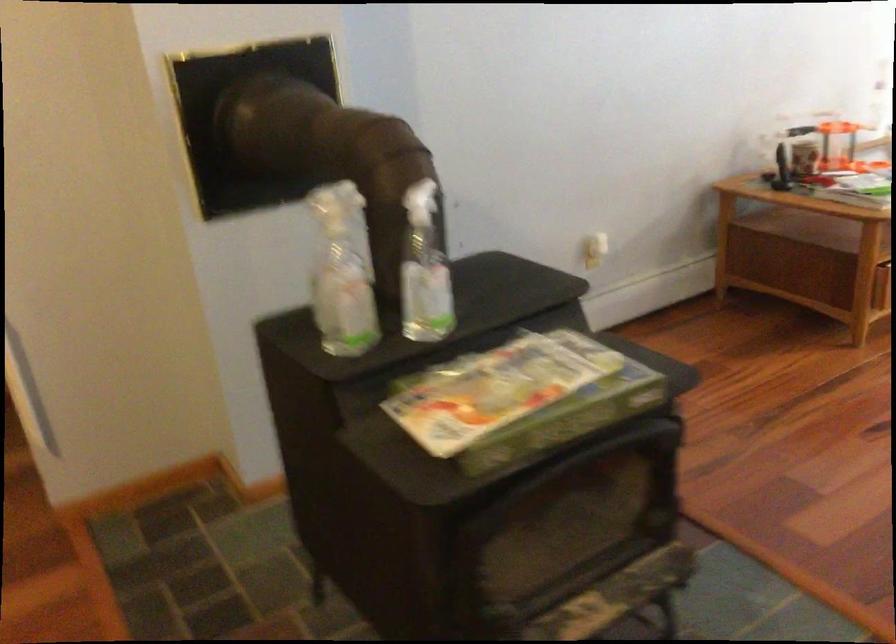
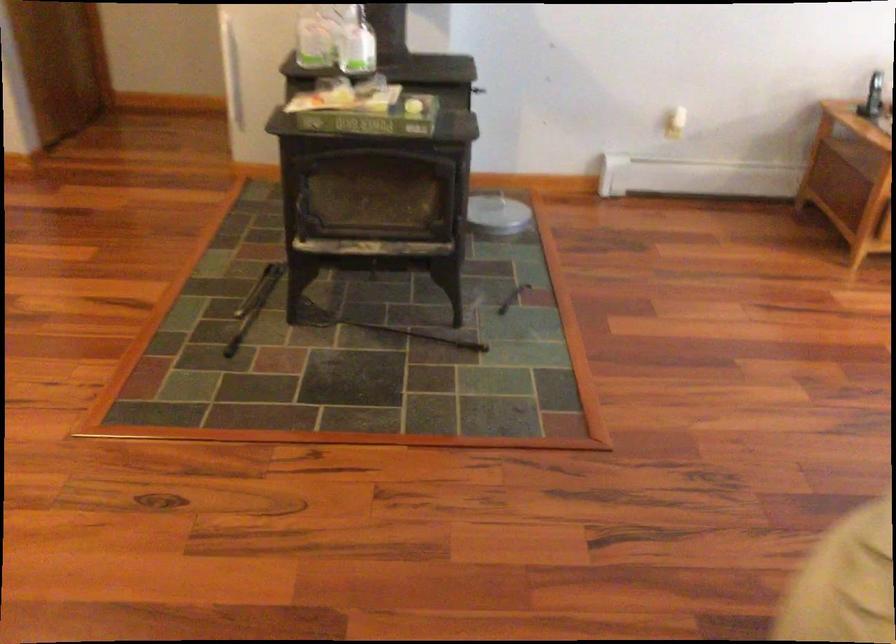
Find the pixel in the second image that matches (x=444, y=290) in the first image.

(357, 46)